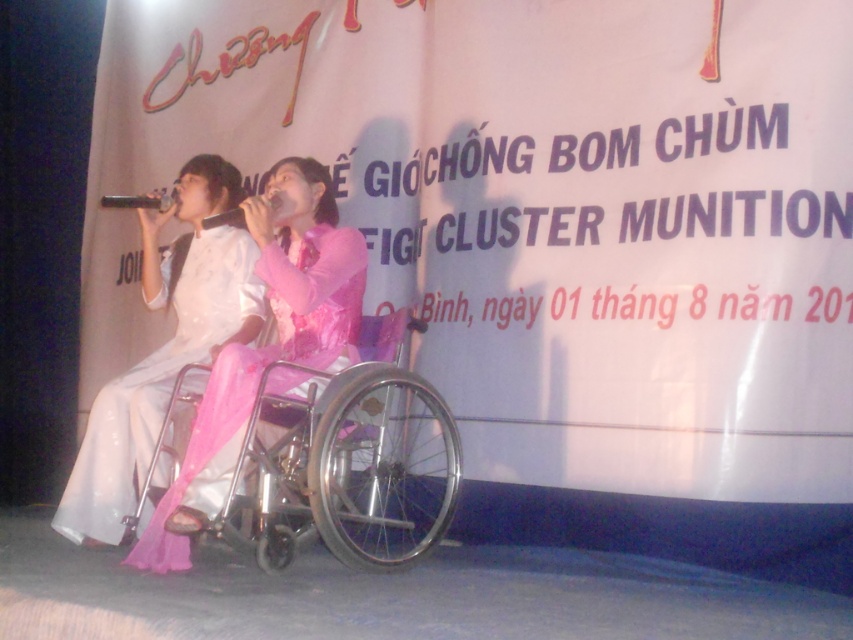
Is silver metallic wheelchair at center positioned before matte black microphone at center?

Yes.

In the scene shown: Is silver metallic wheelchair at center bigger than matte black microphone at center?

Yes, silver metallic wheelchair at center is bigger than matte black microphone at center.

Locate an element on the screen. The image size is (853, 640). silver metallic wheelchair at center is located at coordinates (347, 468).

Which is below, white satin dress at center or matte black microphone at center?

white satin dress at center

Consider the image. Which of these two, white satin dress at center or matte black microphone at center, stands shorter?

matte black microphone at center is shorter.

Which is in front, point (143, 397) or point (234, 208)?

Positioned in front is point (143, 397).

In order to click on white satin dress at center in this screenshot , I will do `click(157, 380)`.

Based on the photo, is white satin dress at center to the left of metallic silver microphone at center from the viewer's perspective?

No, white satin dress at center is not to the left of metallic silver microphone at center.

Can you confirm if white satin dress at center is thinner than metallic silver microphone at center?

In fact, white satin dress at center might be wider than metallic silver microphone at center.

Which is in front, point (131, 460) or point (125, 202)?

Point (131, 460) is more forward.

Where is `white satin dress at center`? This screenshot has width=853, height=640. white satin dress at center is located at coordinates (157, 380).